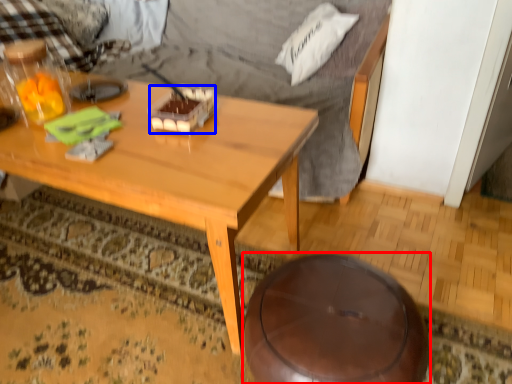
Question: Which of the following is the closest to the observer, stool (highlighted by a red box) or food (highlighted by a blue box)?

Choices:
 (A) stool
 (B) food

Answer: (A)